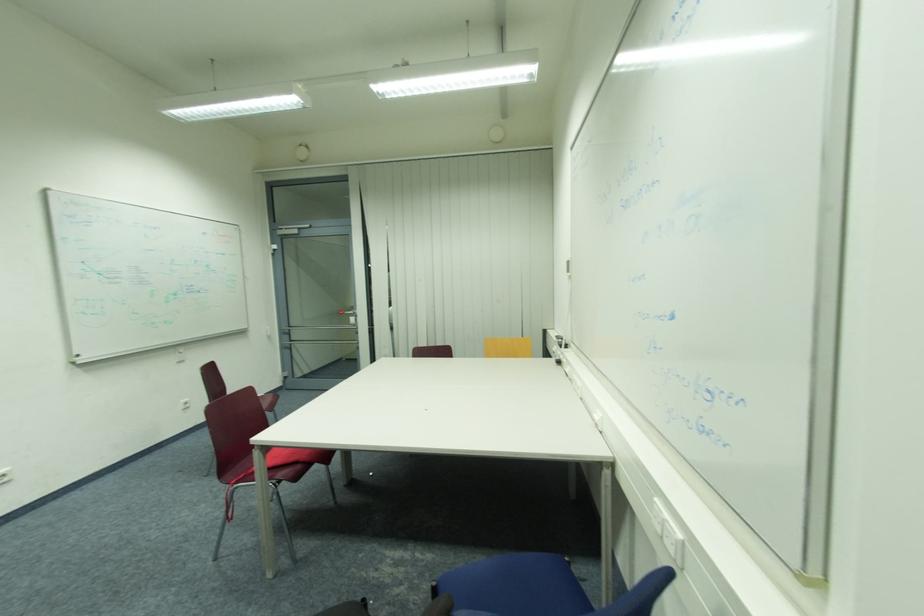
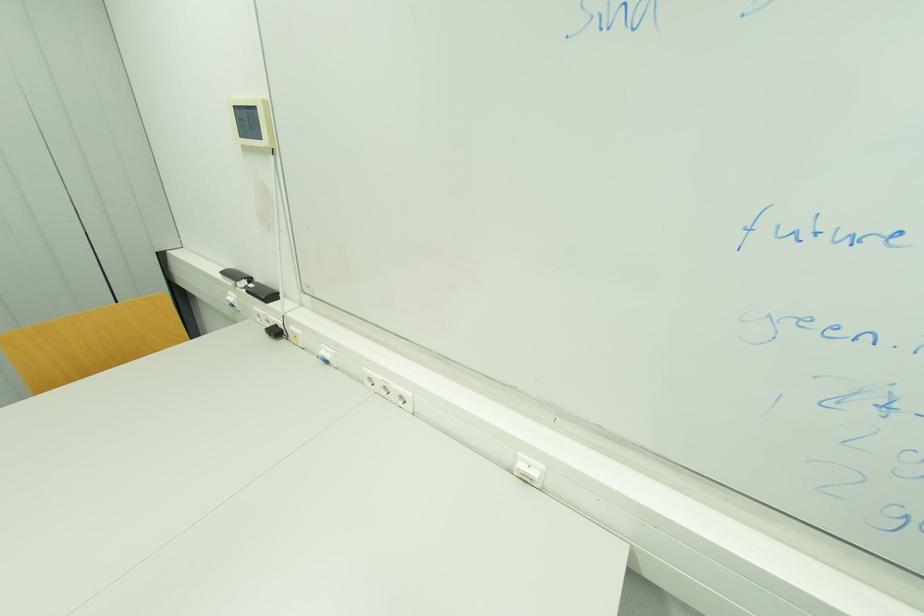
Locate, in the second image, the point that corresponds to point (563, 363) in the first image.

(281, 333)